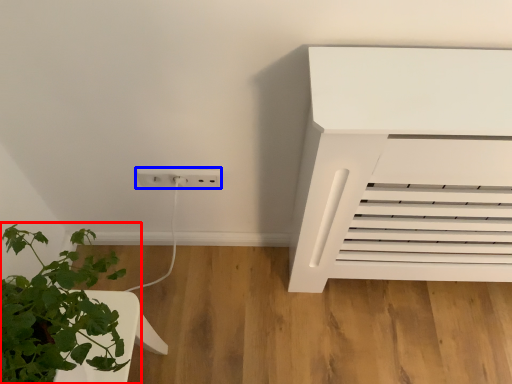
Question: Which of the following is the closest to the observer, houseplant (highlighted by a red box) or electric outlet (highlighted by a blue box)?

Choices:
 (A) houseplant
 (B) electric outlet

Answer: (A)